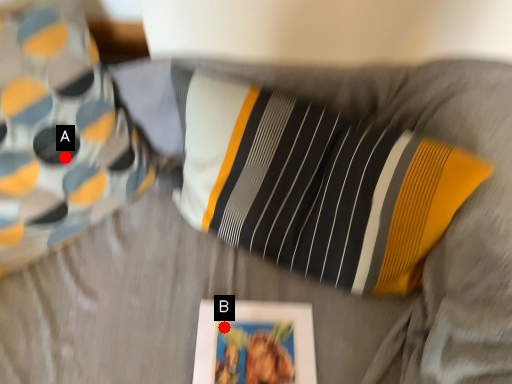
Question: Two points are circled on the image, labeled by A and B beside each circle. Among these points, which one is farthest from the camera?

Choices:
 (A) A is further
 (B) B is further

Answer: (A)